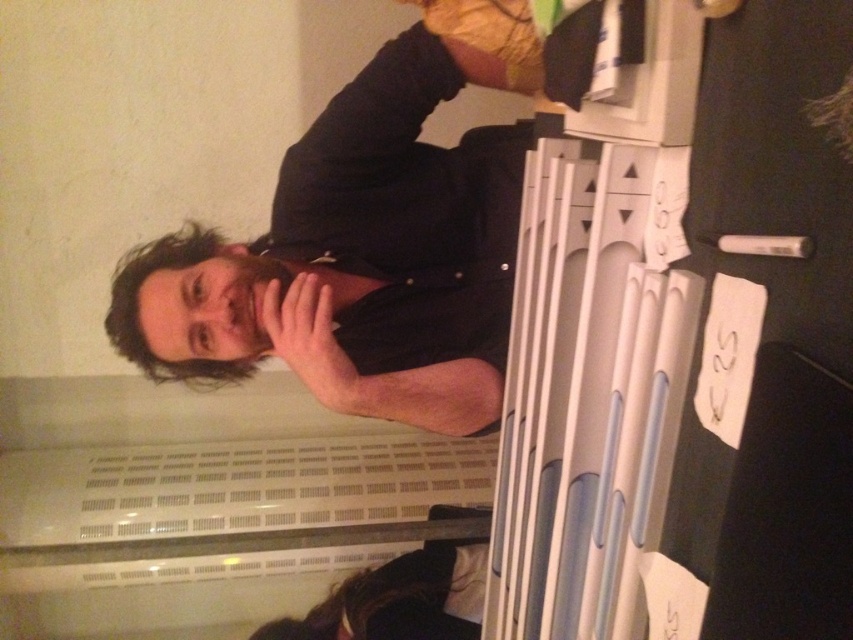
Question: Can you confirm if black matte shirt at center is positioned to the left of dark brown hair at upper left?

Choices:
 (A) no
 (B) yes

Answer: (A)

Question: Is black matte shirt at center thinner than dark brown hair at upper left?

Choices:
 (A) yes
 (B) no

Answer: (B)

Question: In this image, where is black matte shirt at center located relative to dark brown hair at upper left?

Choices:
 (A) above
 (B) below

Answer: (A)

Question: Which object appears farthest from the camera in this image?

Choices:
 (A) dark brown hair at upper left
 (B) black matte shirt at center

Answer: (A)